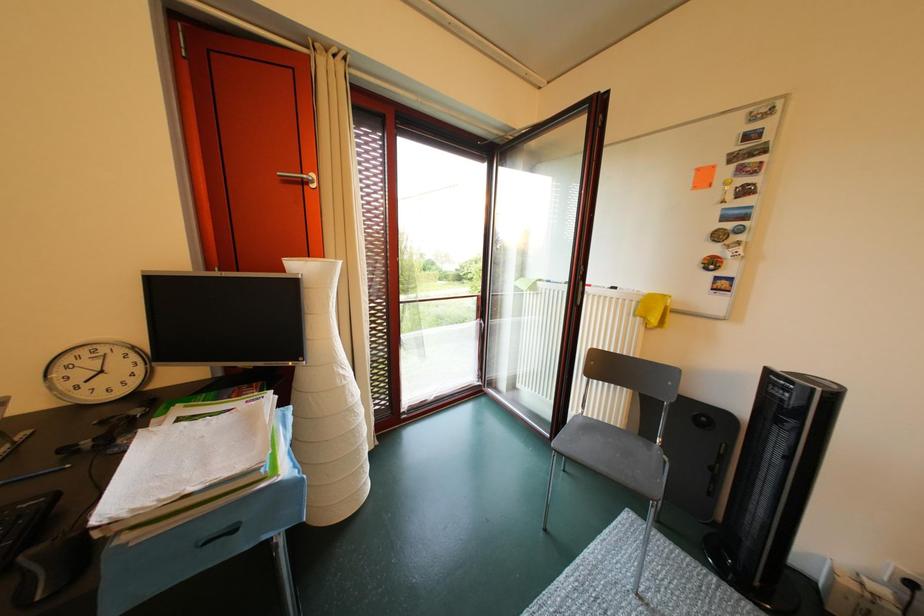
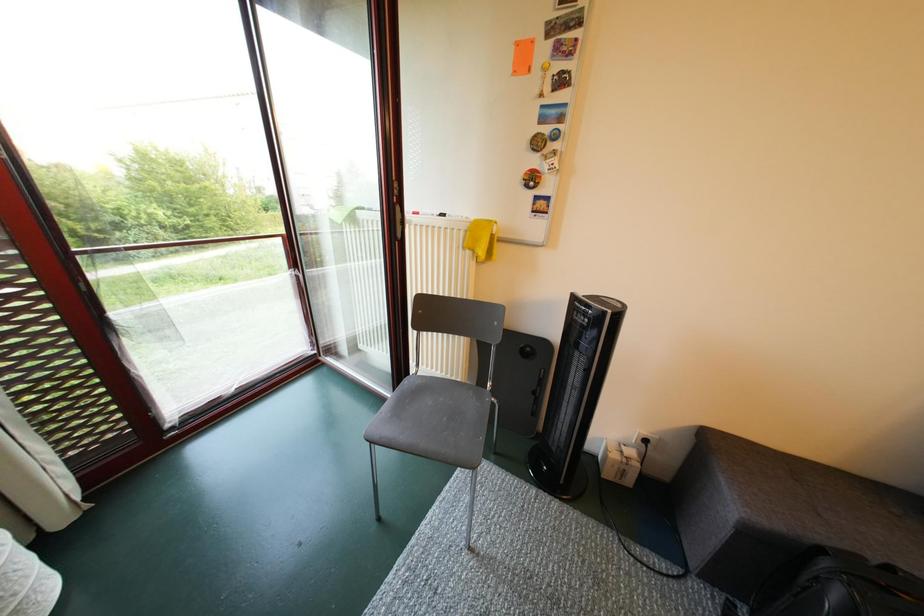
In a continuous first-person perspective shot, in which direction is the camera moving?

The movement direction of the cameraman is right, forward.